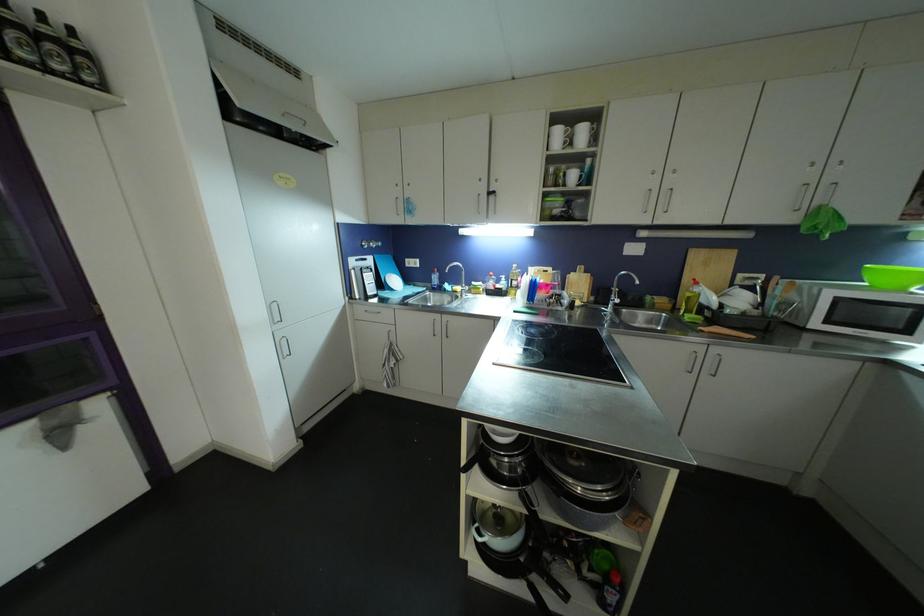
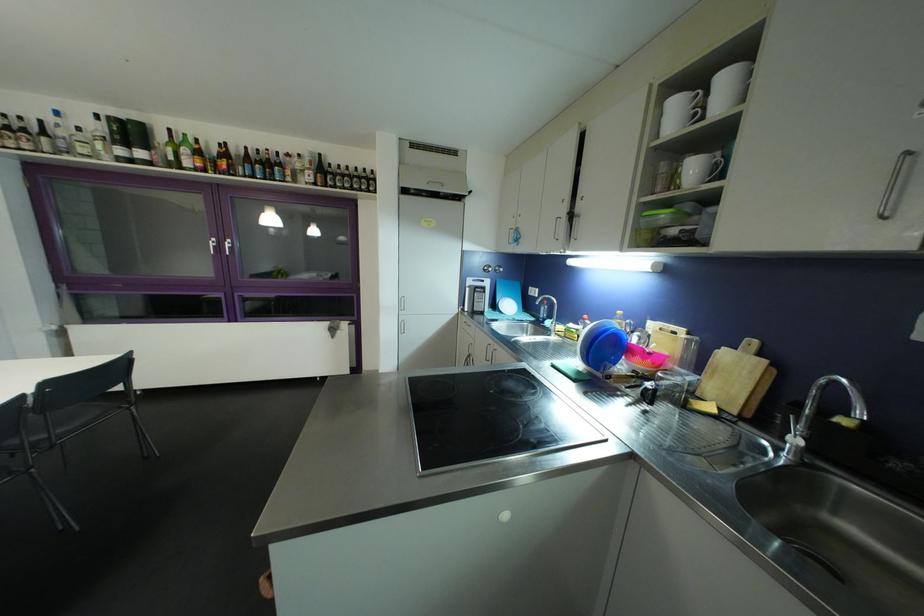
Where in the second image is the point corresponding to (579,278) from the first image?

(732, 358)